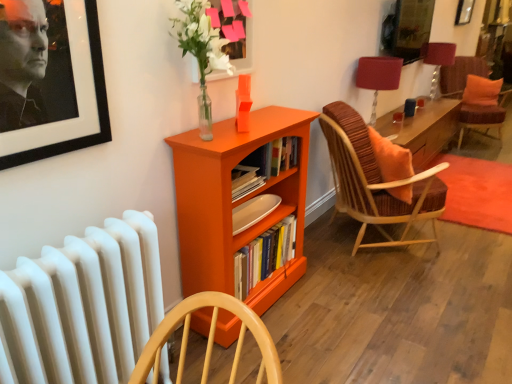
Question: From the image's perspective, is white matte radiator at lower left above matte glass picture frame at upper center?

Choices:
 (A) no
 (B) yes

Answer: (A)

Question: Is white matte radiator at lower left positioned with its back to matte glass picture frame at upper center?

Choices:
 (A) yes
 (B) no

Answer: (B)

Question: Does white matte radiator at lower left appear on the left side of matte glass picture frame at upper center?

Choices:
 (A) yes
 (B) no

Answer: (A)

Question: Is white matte radiator at lower left shorter than matte glass picture frame at upper center?

Choices:
 (A) yes
 (B) no

Answer: (B)

Question: Is white matte radiator at lower left not near matte glass picture frame at upper center?

Choices:
 (A) yes
 (B) no

Answer: (B)

Question: From a real-world perspective, is white matte radiator at lower left on matte glass picture frame at upper center?

Choices:
 (A) yes
 (B) no

Answer: (B)

Question: Can you confirm if orange matte bookcase at center is taller than white matte radiator at lower left?

Choices:
 (A) no
 (B) yes

Answer: (B)

Question: From the image's perspective, is orange matte bookcase at center over white matte radiator at lower left?

Choices:
 (A) yes
 (B) no

Answer: (A)

Question: From a real-world perspective, does orange matte bookcase at center sit lower than white matte radiator at lower left?

Choices:
 (A) no
 (B) yes

Answer: (A)

Question: From a real-world perspective, is orange matte bookcase at center physically above white matte radiator at lower left?

Choices:
 (A) yes
 (B) no

Answer: (A)

Question: Is white matte radiator at lower left at the back of orange matte bookcase at center?

Choices:
 (A) yes
 (B) no

Answer: (B)

Question: Considering the relative sizes of orange matte bookcase at center and white matte radiator at lower left in the image provided, is orange matte bookcase at center shorter than white matte radiator at lower left?

Choices:
 (A) yes
 (B) no

Answer: (B)

Question: Does hardcover books at center have a larger size compared to matte red lampshade at upper right, the 1th table lamp from the front?

Choices:
 (A) no
 (B) yes

Answer: (A)